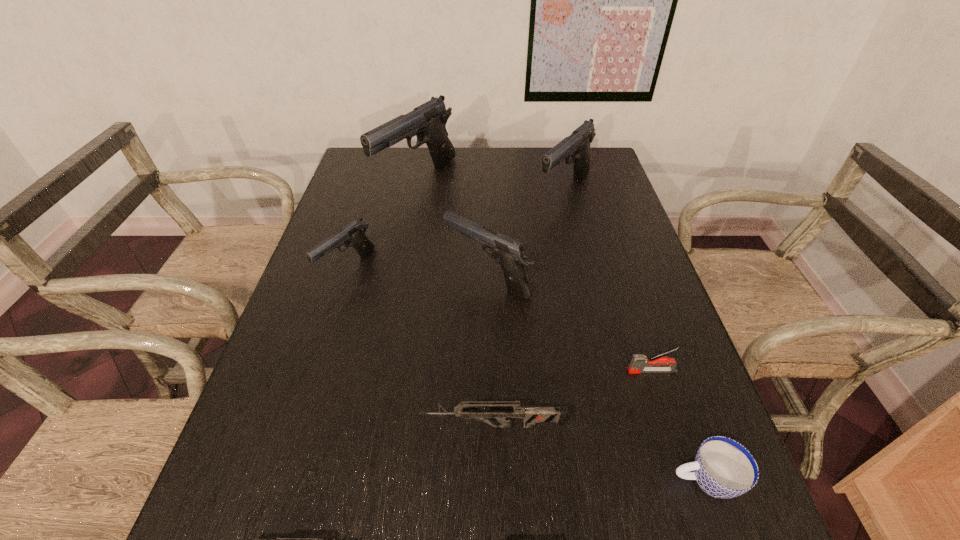
The width and height of the screenshot is (960, 540). I want to click on the second nearest gun, so click(x=531, y=415).

Image resolution: width=960 pixels, height=540 pixels. In order to click on the farther grey gun in this screenshot , I will do `click(531, 415)`.

Where is `the second nearest object`? The image size is (960, 540). the second nearest object is located at coordinates (723, 468).

Locate an element on the screen. blue cup is located at coordinates (723, 468).

Where is `vacant region located 0.270m at the muzzle of the biggest black gun`? The image size is (960, 540). vacant region located 0.270m at the muzzle of the biggest black gun is located at coordinates (400, 269).

You are a GUI agent. You are given a task and a screenshot of the screen. Output one action in this format:
    pyautogui.click(x=<x>, y=<y>)
    Task: Click on the vacant space located at the muzzle of the third smallest black gun
    
    Given the screenshot: What is the action you would take?
    pyautogui.click(x=590, y=299)

At what (x,y) coordinates should I click in order to perform the action: click on free space located 0.270m at the muzzle of the fourth shortest gun. Please return your answer as a coordinate pair (x, y). This screenshot has height=540, width=960. Looking at the image, I should click on (340, 278).

Where is `vacant space located 0.080m at the muzzle of the fourth shortest gun`? vacant space located 0.080m at the muzzle of the fourth shortest gun is located at coordinates (415, 278).

You are a GUI agent. You are given a task and a screenshot of the screen. Output one action in this format:
    pyautogui.click(x=<x>, y=<y>)
    Task: Click on the free spot located at the muzzle of the fourth shortest gun
    
    Given the screenshot: What is the action you would take?
    pyautogui.click(x=379, y=278)

In order to click on blank space located 0.110m at the muzzle of the fourth tallest object in this screenshot , I will do `click(329, 324)`.